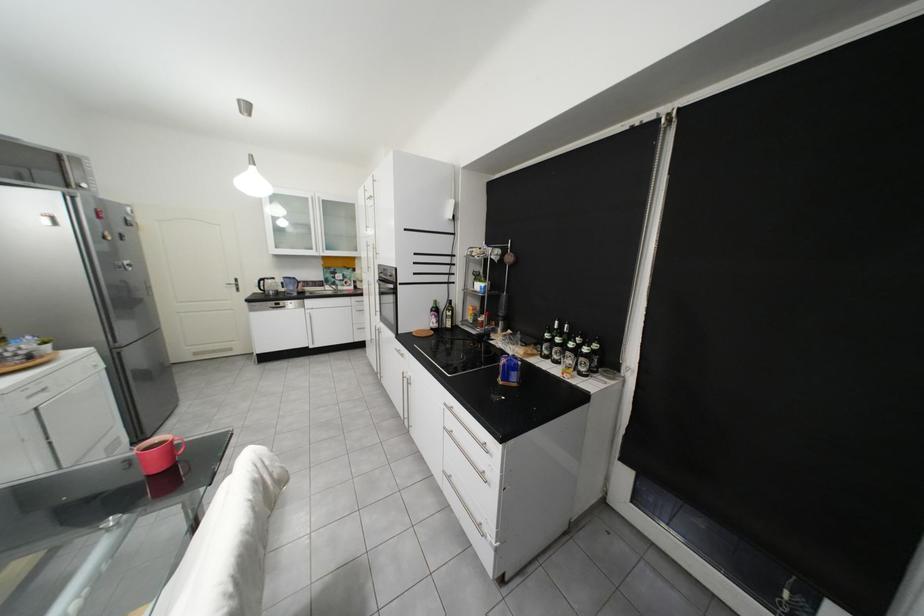
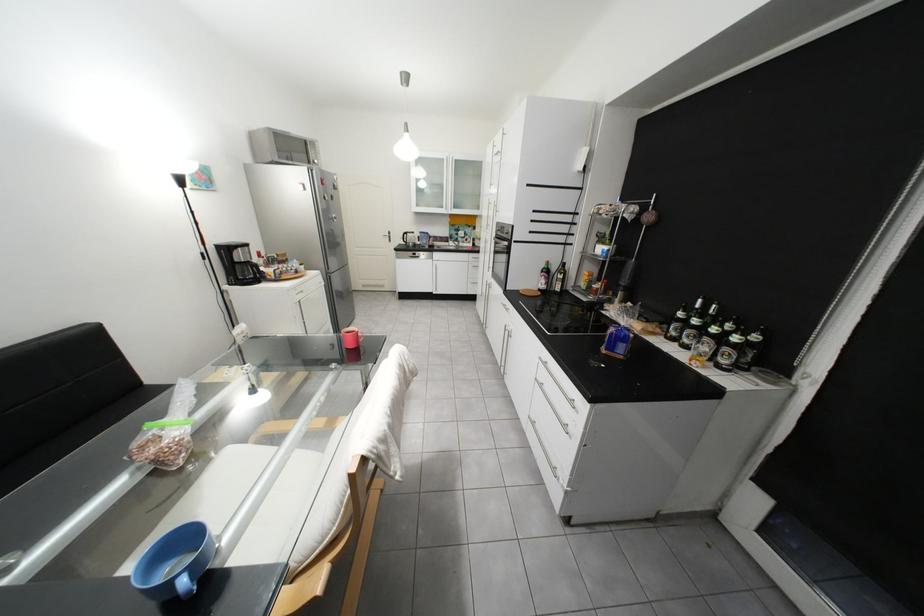
Locate, in the second image, the point that corresponds to [460,429] in the first image.

(553, 382)